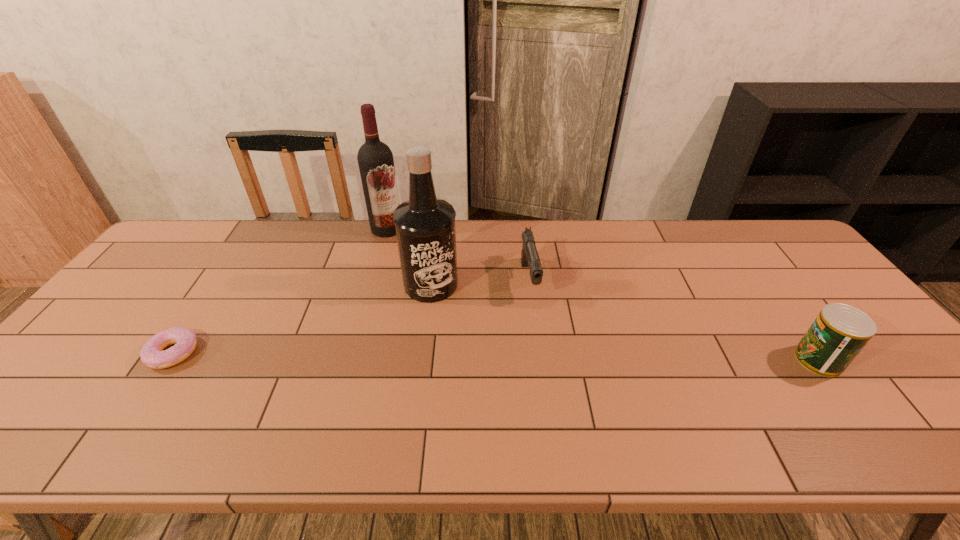
The image size is (960, 540). I want to click on the leftmost object, so click(x=152, y=354).

You are a GUI agent. You are given a task and a screenshot of the screen. Output one action in this format:
    pyautogui.click(x=<x>, y=<y>)
    Task: Click on the shortest object
    The width and height of the screenshot is (960, 540).
    Given the screenshot: What is the action you would take?
    pyautogui.click(x=152, y=354)

Find the location of `can`. can is located at coordinates (838, 334).

I want to click on the third object from right to left, so click(x=425, y=230).

Locate an element on the screen. The height and width of the screenshot is (540, 960). the fourth object from left to right is located at coordinates tap(529, 256).

The height and width of the screenshot is (540, 960). Identify the location of wine bottle. (375, 159).

This screenshot has width=960, height=540. In order to click on the farthest object in this screenshot , I will do `click(375, 159)`.

Locate an element on the screen. The width and height of the screenshot is (960, 540). free spot located on the right of the leftmost object is located at coordinates (348, 353).

Find the location of a particular element. Image resolution: width=960 pixels, height=540 pixels. vacant space located on the back of the can is located at coordinates [x=761, y=281].

Where is `free space located on the front label of the third object from left to right`? free space located on the front label of the third object from left to right is located at coordinates (491, 366).